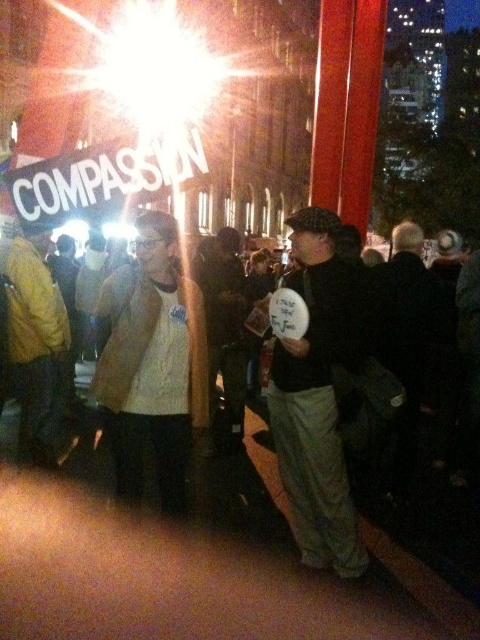
You are a photographer aiming to capture a photo of the matte black shirt at center and the yellow fabric jacket at left. Based on their positions, which one would appear larger in the photo?

The matte black shirt at center appears larger in the photo because it has a greater height compared to the yellow fabric jacket at left.

You are standing in the crowd and want to locate the matte black shirt at center and the yellow fabric jacket at left. According to the scene, which one is positioned to the right of the other?

The matte black shirt at center is to the right of the yellow fabric jacket at left.

In the nighttime gathering scene, there is a crowd holding signs, including one with the word COMPASSION on a black background. You notice a person wearing a matte black shirt at the center of the image. Can you determine the spatial relationship between the matte black shirt at center and the point marked at coordinate (319, 394)?

The point marked at coordinate (319, 394) corresponds to the location of the matte black shirt at center, indicating they are in the same position.